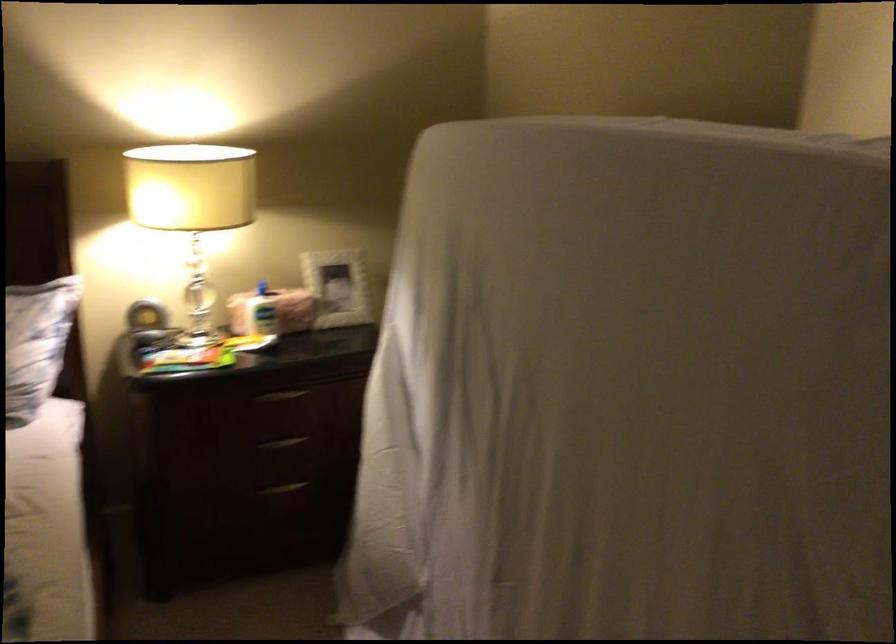
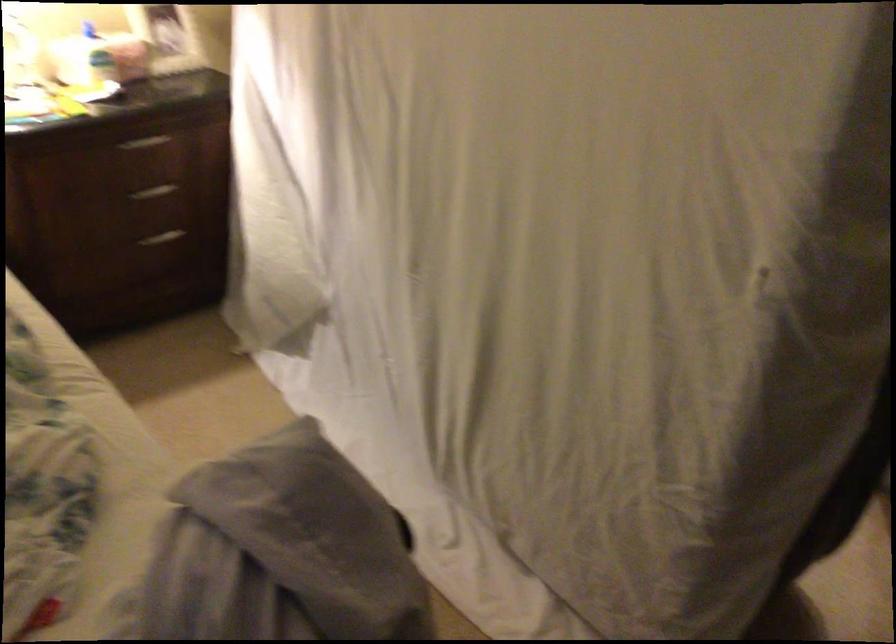
First-person continuous shooting, in which direction is the camera rotating?

The camera rotated toward right-down.